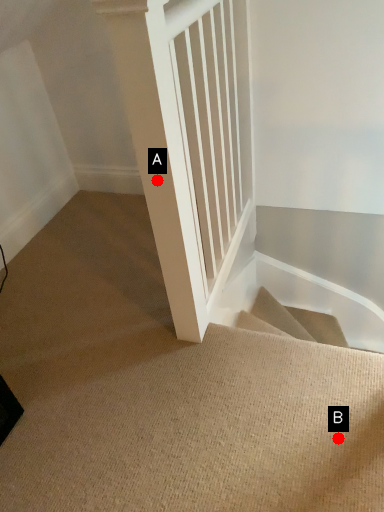
Question: Two points are circled on the image, labeled by A and B beside each circle. Which of the following is the closest to the observer?

Choices:
 (A) A is closer
 (B) B is closer

Answer: (A)